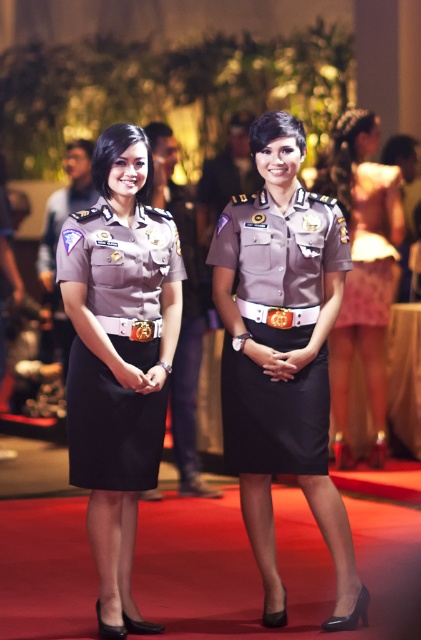
Question: Which point is farther to the camera?

Choices:
 (A) matte gray uniform at center
 (B) silky pink dress at right

Answer: (B)

Question: Can you confirm if matte black dress at center is positioned below matte uniform at center?

Choices:
 (A) no
 (B) yes

Answer: (B)

Question: Can you confirm if matte gray uniform at center is positioned below matte uniform at center?

Choices:
 (A) yes
 (B) no

Answer: (A)

Question: Which object is farther from the camera taking this photo?

Choices:
 (A) matte black dress at center
 (B) matte uniform at center
 (C) matte gray uniform at center
 (D) silky pink dress at right

Answer: (B)

Question: In this image, where is matte gray uniform at center located relative to matte uniform at center?

Choices:
 (A) below
 (B) above

Answer: (A)

Question: Based on their relative distances, which object is nearer to the matte uniform at center?

Choices:
 (A) matte black dress at center
 (B) matte gray uniform at center
 (C) silky pink dress at right

Answer: (C)